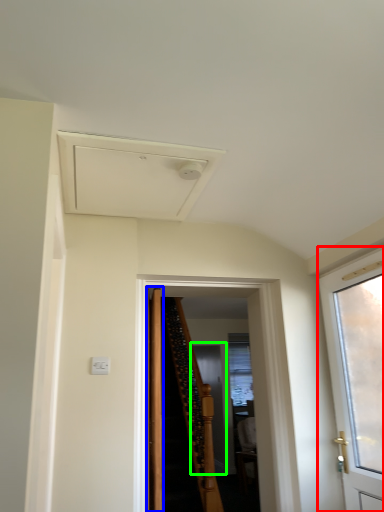
Question: Which object is the farthest from door (highlighted by a red box)? Choose among these: door (highlighted by a blue box) or screen door (highlighted by a green box).

Choices:
 (A) door
 (B) screen door

Answer: (B)